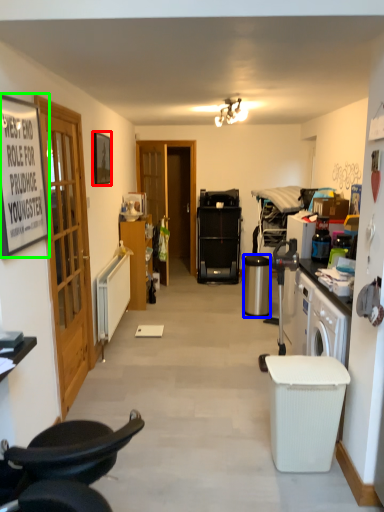
Question: Estimate the real-world distances between objects in this image. Which object is farther from picture frame (highlighted by a red box), trash bin/can (highlighted by a blue box) or picture frame (highlighted by a green box)?

Choices:
 (A) trash bin/can
 (B) picture frame

Answer: (A)